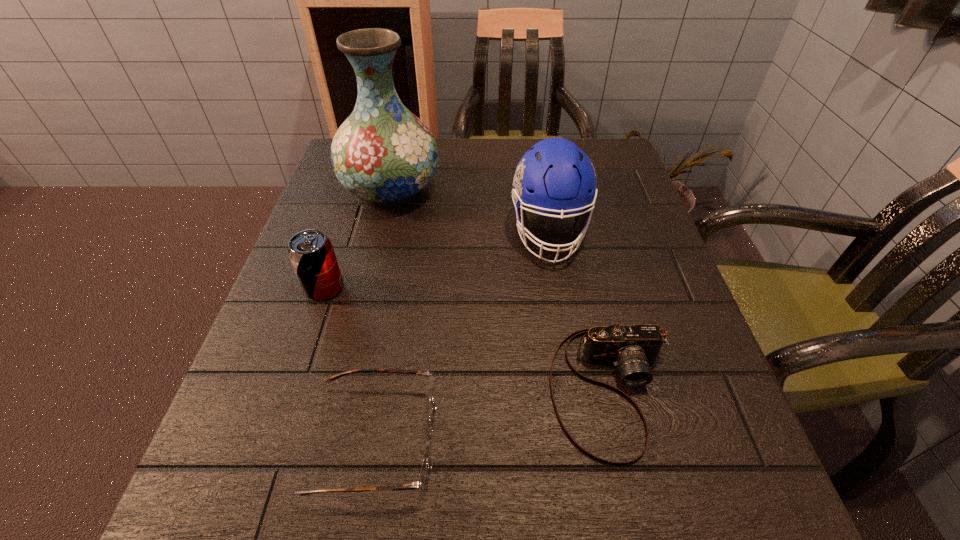
This screenshot has width=960, height=540. What are the coordinates of `vacant space in between the soda can and the fourth shortest object` in the screenshot? It's located at (437, 260).

At what (x,y) coordinates should I click in order to perform the action: click on empty space between the fourth tallest object and the third nearest object. Please return your answer as a coordinate pair (x, y). This screenshot has height=540, width=960. Looking at the image, I should click on (468, 339).

I want to click on free space between the shortest object and the vase, so click(x=383, y=314).

At what (x,y) coordinates should I click in order to perform the action: click on blank region between the second shortest object and the third farthest object. Please return your answer as a coordinate pair (x, y). The width and height of the screenshot is (960, 540). Looking at the image, I should click on (468, 339).

Select which object appears as the closest to the second tallest object. Please provide its 2D coordinates. Your answer should be formatted as a tuple, i.e. [(x, y)], where the tuple contains the x and y coordinates of a point satisfying the conditions above.

[(632, 348)]

In order to click on object that stands as the third closest to the third farthest object in this screenshot , I will do click(x=554, y=176).

Where is `free space that satisfies the following two spatial constraints: 1. on the face guard of the fourth shortest object; 2. on the front-facing side of the spectacles`? free space that satisfies the following two spatial constraints: 1. on the face guard of the fourth shortest object; 2. on the front-facing side of the spectacles is located at coordinates (584, 440).

Locate an element on the screen. This screenshot has height=540, width=960. vacant position in the image that satisfies the following two spatial constraints: 1. on the front-facing side of the fourth tallest object; 2. on the front-facing side of the spectacles is located at coordinates (622, 440).

At what (x,y) coordinates should I click in order to perform the action: click on blank area in the image that satisfies the following two spatial constraints: 1. on the front-facing side of the fourth tallest object; 2. on the front-facing side of the spectacles. Please return your answer as a coordinate pair (x, y). Looking at the image, I should click on (622, 440).

Locate an element on the screen. free space that satisfies the following two spatial constraints: 1. on the front-facing side of the camera; 2. on the front-facing side of the spectacles is located at coordinates (622, 440).